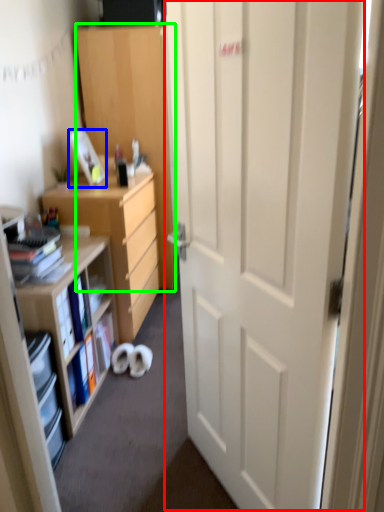
Question: Which is farther away from door (highlighted by a red box)? picture frame (highlighted by a blue box) or cabinetry (highlighted by a green box)?

Choices:
 (A) picture frame
 (B) cabinetry

Answer: (B)